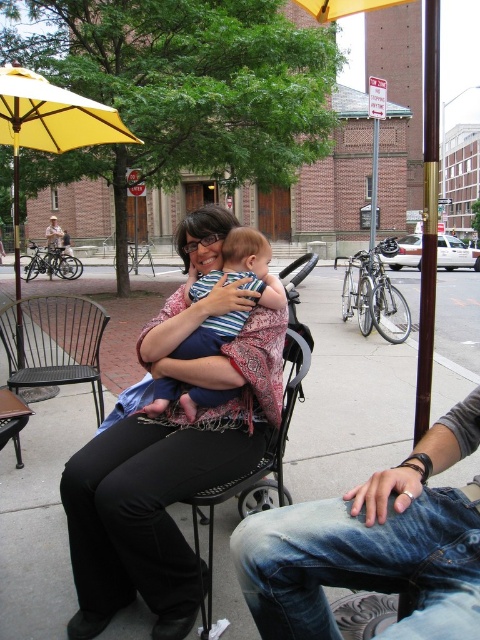
You are standing at the center of the image. Where is the jeans at lower right located relative to your position?

The jeans at lower right is located at point (373, 545) relative to the image center.

You are a photographer trying to capture a detailed shot of both the jeans at lower right and the yellow fabric umbrella at upper left. Since you want to ensure both are in focus, you need to know which object is wider. Which one is wider?

The yellow fabric umbrella at upper left is wider than the jeans at lower right.

In the scene shown: You are standing in the outdoor scene and want to place a small potted plant between the jeans at lower right and the yellow fabric umbrella at upper left. Based on their positions, where should you place the plant?

The jeans at lower right is located below the yellow fabric umbrella at upper left, so you should place the small potted plant between them in the middle area between the jeans at lower right and the yellow fabric umbrella at upper left.